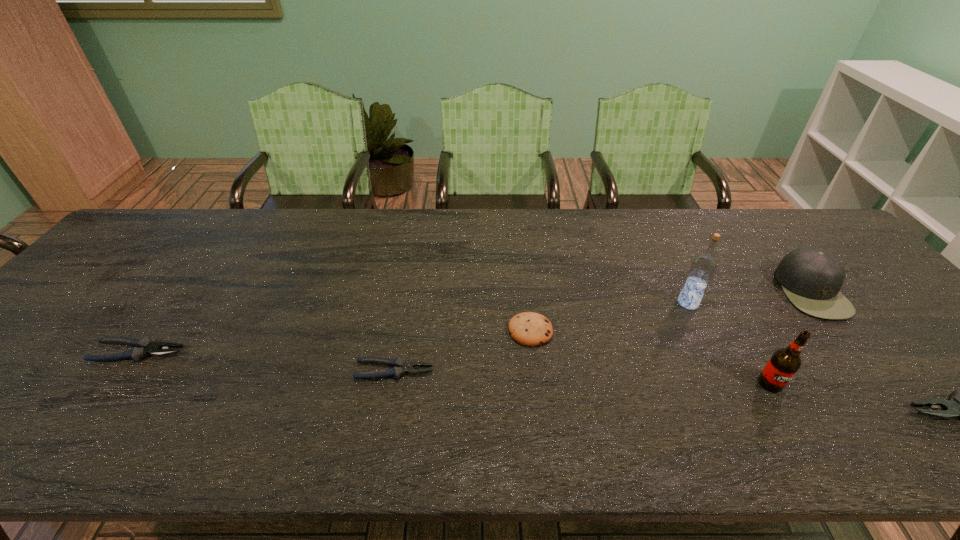
The image size is (960, 540). I want to click on vacant space situated at the gripping part of the second shortest object, so click(222, 352).

Find the location of a particular element. The image size is (960, 540). free region located at the gripping part of the sixth object from right to left is located at coordinates (595, 370).

Identify the location of vacant space situated on the brim of the third tallest object. The image size is (960, 540). (705, 291).

You are a GUI agent. You are given a task and a screenshot of the screen. Output one action in this format:
    pyautogui.click(x=<x>, y=<y>)
    Task: Click on the free spot located 0.190m on the brim of the third tallest object
    The height and width of the screenshot is (540, 960).
    Given the screenshot: What is the action you would take?
    pyautogui.click(x=712, y=291)

The height and width of the screenshot is (540, 960). What are the coordinates of `blank space located 0.130m on the brim of the third tallest object` in the screenshot? It's located at (734, 291).

Find the location of a particular element. This screenshot has height=540, width=960. free space located on the right of the tallest object is located at coordinates (812, 303).

Where is `free point located 0.220m on the left of the third object from left to right`? The height and width of the screenshot is (540, 960). free point located 0.220m on the left of the third object from left to right is located at coordinates (420, 331).

Identify the location of free region located on the back of the third object from right to left. (730, 313).

At what (x,y) coordinates should I click in order to perform the action: click on pliers at the near edge. Please return your answer as a coordinate pair (x, y). Looking at the image, I should click on (400, 367).

The width and height of the screenshot is (960, 540). What are the coordinates of `root beer located at the near edge` in the screenshot? It's located at (784, 363).